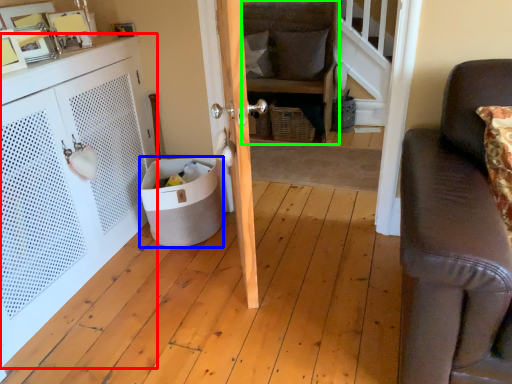
Question: Considering the real-world distances, which object is closest to cabinetry (highlighted by a red box)? trash bin/can (highlighted by a blue box) or chair (highlighted by a green box).

Choices:
 (A) trash bin/can
 (B) chair

Answer: (A)